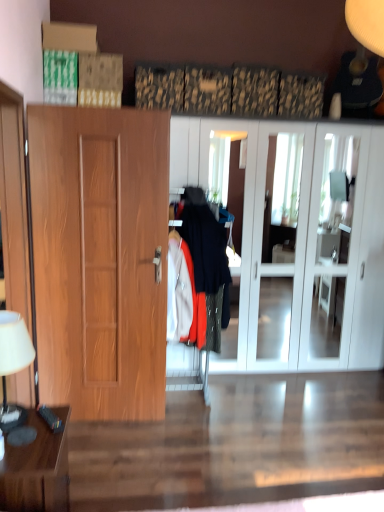
Identify the location of empty space that is to the right of wooden door at left. pyautogui.click(x=178, y=433).